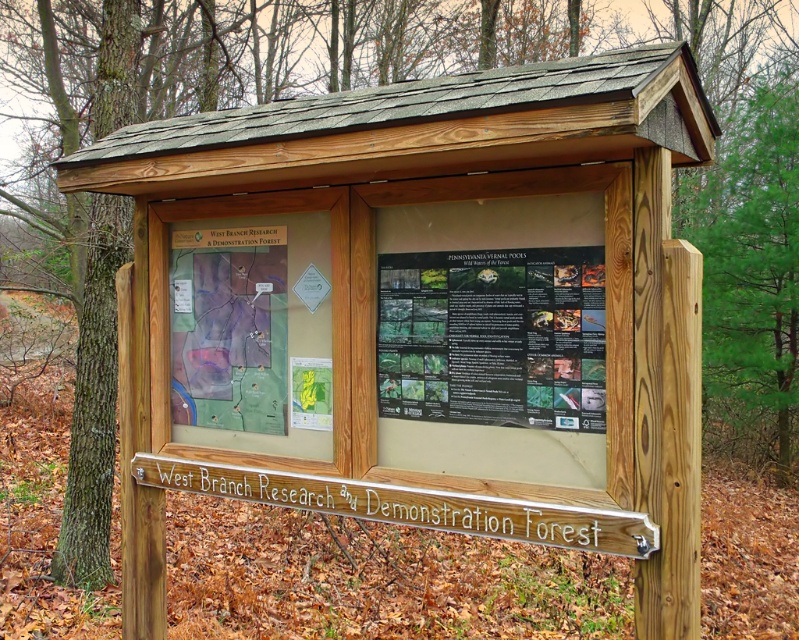
You are a hiker who wants to read the map inside the kiosk. The kiosk has a black paper poster at center and a transparent plastic map at center. Which object is closer to you when you look through the transparent front panel of the kiosk?

The black paper poster at center is closer to you because it is in front of the transparent plastic map at center.